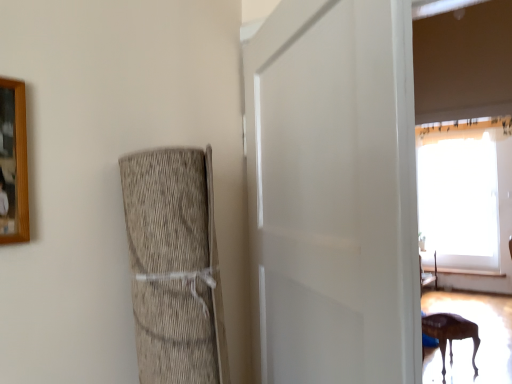
Question: Is wooden picture frame at upper left looking in the opposite direction of wooden table at lower right?

Choices:
 (A) yes
 (B) no

Answer: (B)

Question: From a real-world perspective, is wooden picture frame at upper left below wooden table at lower right?

Choices:
 (A) no
 (B) yes

Answer: (A)

Question: Is wooden picture frame at upper left to the right of wooden table at lower right from the viewer's perspective?

Choices:
 (A) no
 (B) yes

Answer: (A)

Question: Considering the relative positions of wooden picture frame at upper left and wooden table at lower right in the image provided, is wooden picture frame at upper left to the left of wooden table at lower right from the viewer's perspective?

Choices:
 (A) yes
 (B) no

Answer: (A)

Question: Is wooden picture frame at upper left thinner than wooden table at lower right?

Choices:
 (A) no
 (B) yes

Answer: (B)

Question: From a real-world perspective, is wooden picture frame at upper left physically above wooden table at lower right?

Choices:
 (A) yes
 (B) no

Answer: (A)

Question: Is white matte door at center completely or partially inside wooden table at lower right?

Choices:
 (A) no
 (B) yes

Answer: (A)

Question: From a real-world perspective, is wooden table at lower right positioned over white matte door at center based on gravity?

Choices:
 (A) yes
 (B) no

Answer: (B)

Question: Does wooden table at lower right come behind white matte door at center?

Choices:
 (A) yes
 (B) no

Answer: (A)

Question: Considering the relative positions of wooden table at lower right and white matte door at center in the image provided, is wooden table at lower right to the right of white matte door at center from the viewer's perspective?

Choices:
 (A) no
 (B) yes

Answer: (B)

Question: Does wooden table at lower right turn towards white matte door at center?

Choices:
 (A) no
 (B) yes

Answer: (A)

Question: From the image's perspective, is wooden table at lower right located beneath white matte door at center?

Choices:
 (A) yes
 (B) no

Answer: (A)

Question: Is wooden picture frame at upper left inside white matte door at center?

Choices:
 (A) no
 (B) yes

Answer: (A)